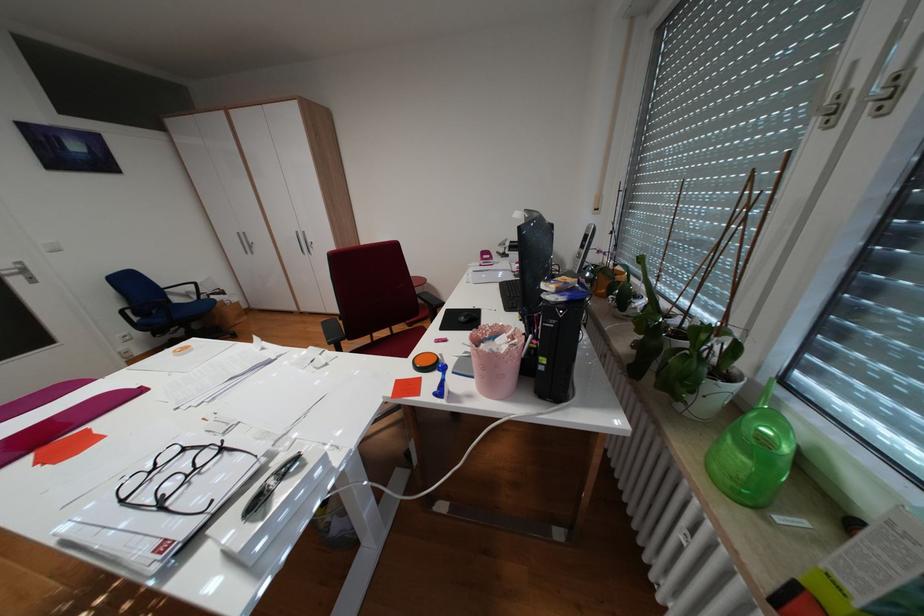
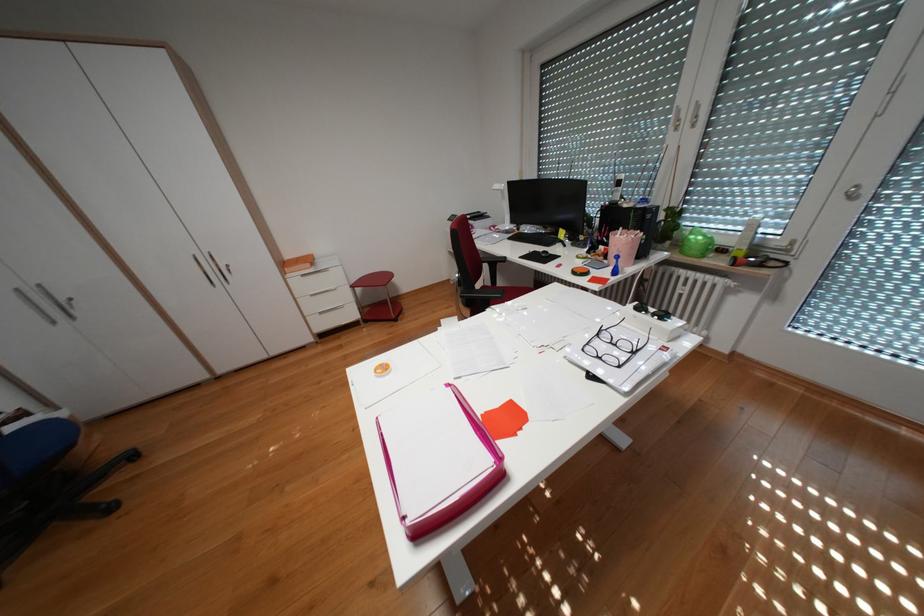
In the second image, find the point that corresponds to point (871, 82) in the first image.

(695, 116)